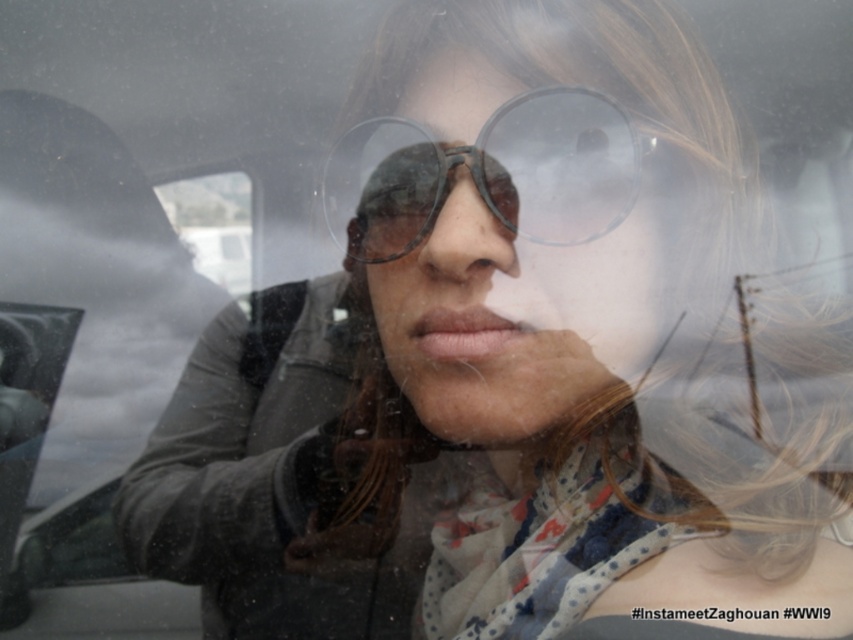
You are a designer creating a new product that requires precise measurements. You have two items in front of you, the transparent plastic goggles at center and the matte plastic nose at center. Based on the scene, which item has a greater height?

The transparent plastic goggles at center is much taller than the matte plastic nose at center, so the transparent plastic goggles at center has a greater height.

You are a safety inspector checking the equipment of a worker. The worker has both transparent plastic goggles at center and matte plastic nose at center. According to the safety guidelines, the goggles must be positioned to the right of the nose. Does the current arrangement comply with the safety standards?

Yes, the transparent plastic goggles at center are positioned to the right of the matte plastic nose at center, so the arrangement complies with the safety standards.

You are a passenger in the car and want to know if the point at coordinates point (x=363, y=164) is closer to you than point (x=439, y=202). Can you determine this based on the scene?

Point (x=363, y=164) is behind point (x=439, y=202), so it is farther away from you as a passenger in the car.